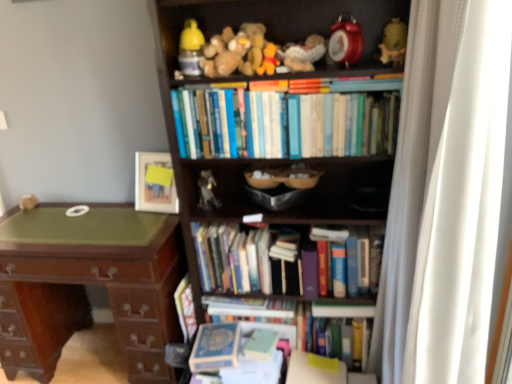
At what (x,y) coordinates should I click in order to perform the action: click on free space above hardcover book at lower center, the 5th book in the top-to-bottom sequence (from a real-world perspective). Please return your answer as a coordinate pair (x, y). Image resolution: width=512 pixels, height=384 pixels. Looking at the image, I should click on (226, 332).